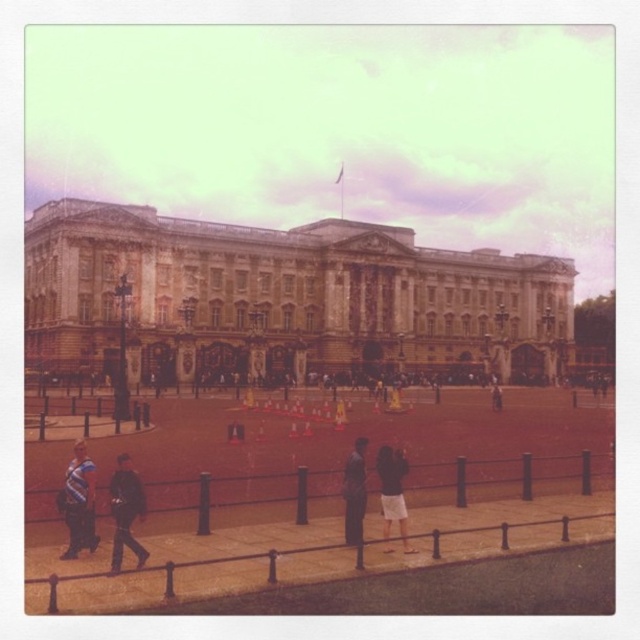
Is point (531, 524) in front of point (83, 458)?

No, it is behind (83, 458).

Can you confirm if brown metal fence at lower center is taller than striped shirt at lower left?

No.

This screenshot has height=640, width=640. Identify the location of brown metal fence at lower center. point(196,566).

Does dark blue leather jacket at lower left have a smaller size compared to dark gray fabric jacket at center?

No.

Between dark blue leather jacket at lower left and dark gray fabric jacket at center, which one is positioned higher?

Positioned higher is dark gray fabric jacket at center.

This screenshot has height=640, width=640. I want to click on dark blue leather jacket at lower left, so click(125, 512).

Locate an element on the screen. The width and height of the screenshot is (640, 640). dark blue leather jacket at lower left is located at coordinates (125, 512).

Can you confirm if brown metal fence at lower center is shorter than dark blue leather jacket at lower left?

Correct, brown metal fence at lower center is not as tall as dark blue leather jacket at lower left.

Is brown metal fence at lower center bigger than dark blue leather jacket at lower left?

Yes.

Is point (35, 579) closer to camera compared to point (122, 456)?

Yes, point (35, 579) is in front of point (122, 456).

Image resolution: width=640 pixels, height=640 pixels. What are the coordinates of `brown metal fence at lower center` in the screenshot? It's located at (196, 566).